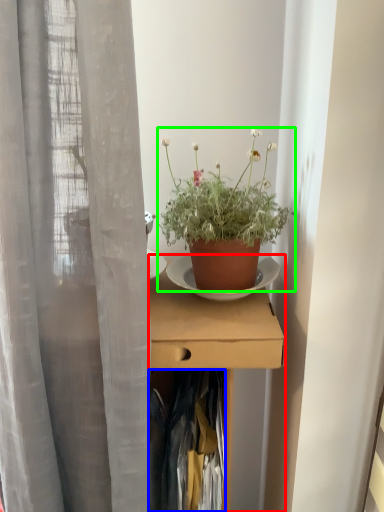
Question: Which object is positioned farthest from desk (highlighted by a red box)? Select from clothing (highlighted by a blue box) and houseplant (highlighted by a green box).

Choices:
 (A) clothing
 (B) houseplant

Answer: (B)